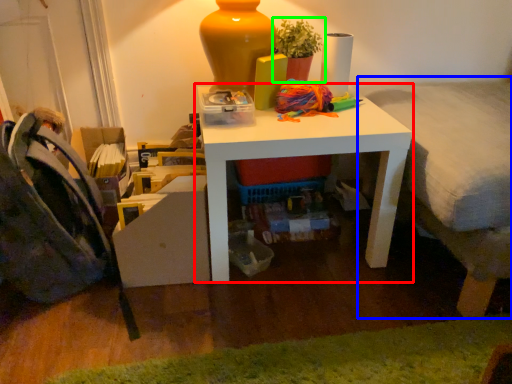
Question: Considering the real-world distances, which object is farthest from table (highlighted by a red box)? bed (highlighted by a blue box) or houseplant (highlighted by a green box)?

Choices:
 (A) bed
 (B) houseplant

Answer: (B)